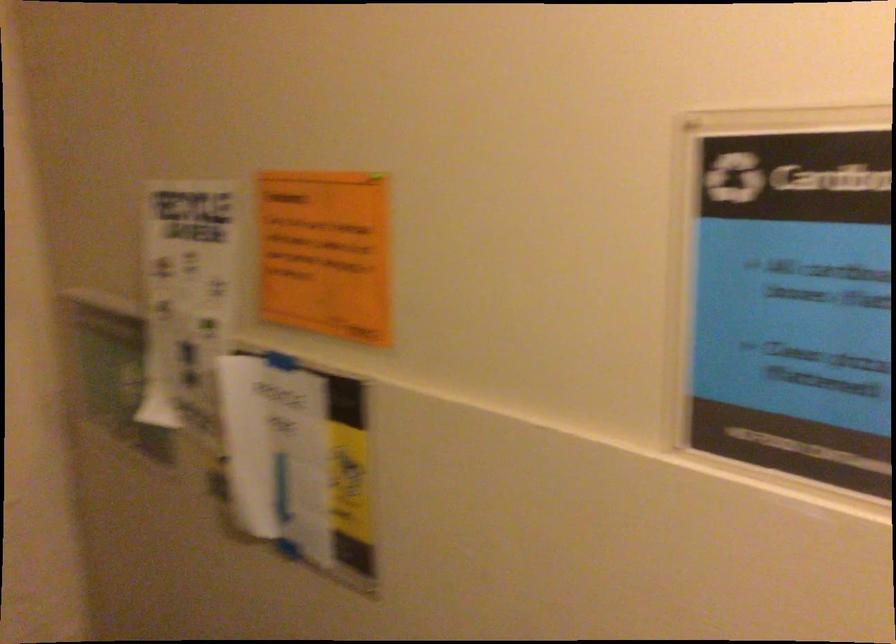
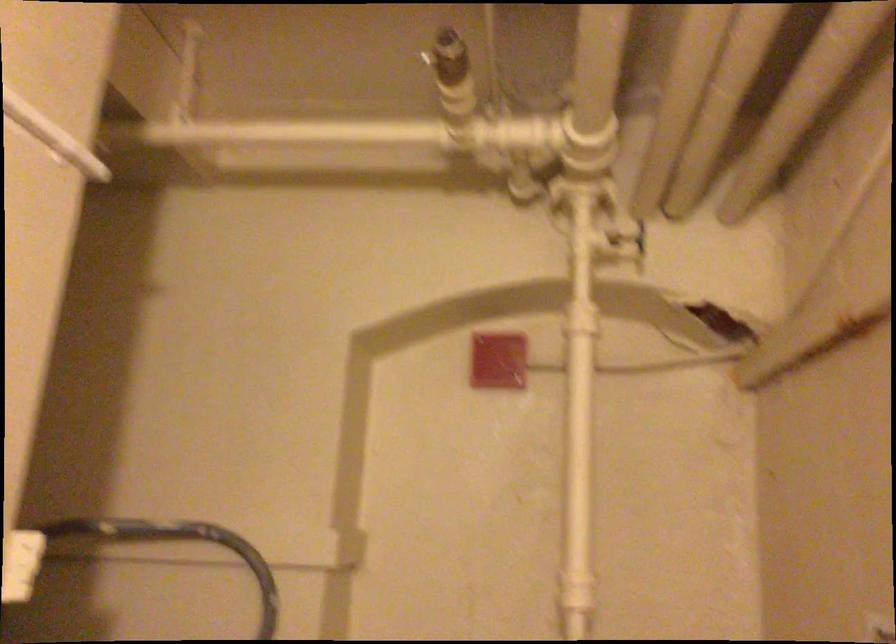
The first image is from the beginning of the video and the second image is from the end. How did the camera likely rotate when shooting the video?

The rotation direction of the camera is left-up.